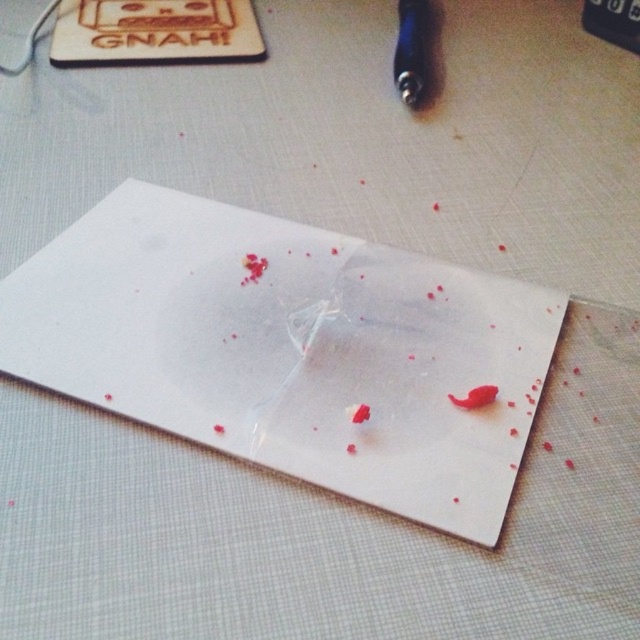
Can you confirm if white matte paper at center is shorter than metallic blue pen at upper right?

No, white matte paper at center is not shorter than metallic blue pen at upper right.

At what (x,y) coordinates should I click in order to perform the action: click on white matte paper at center. Please return your answer as a coordinate pair (x, y). The height and width of the screenshot is (640, 640). Looking at the image, I should click on (291, 349).

Where is `white matte paper at center`? This screenshot has height=640, width=640. white matte paper at center is located at coordinates (291, 349).

Which is above, white matte paper at center or blood matte liquid at lower right?

white matte paper at center

Does white matte paper at center have a greater height compared to blood matte liquid at lower right?

Correct, white matte paper at center is much taller as blood matte liquid at lower right.

Who is more forward, [394,321] or [476,406]?

Point [476,406] is in front.

Locate an element on the screen. The width and height of the screenshot is (640, 640). white matte paper at center is located at coordinates (291, 349).

Is point (422, 67) farther from viewer compared to point (486, 388)?

Yes, it is.

Where is `metallic blue pen at upper right`? The width and height of the screenshot is (640, 640). metallic blue pen at upper right is located at coordinates (410, 51).

At what (x,y) coordinates should I click in order to perform the action: click on metallic blue pen at upper right. Please return your answer as a coordinate pair (x, y). This screenshot has width=640, height=640. Looking at the image, I should click on (410, 51).